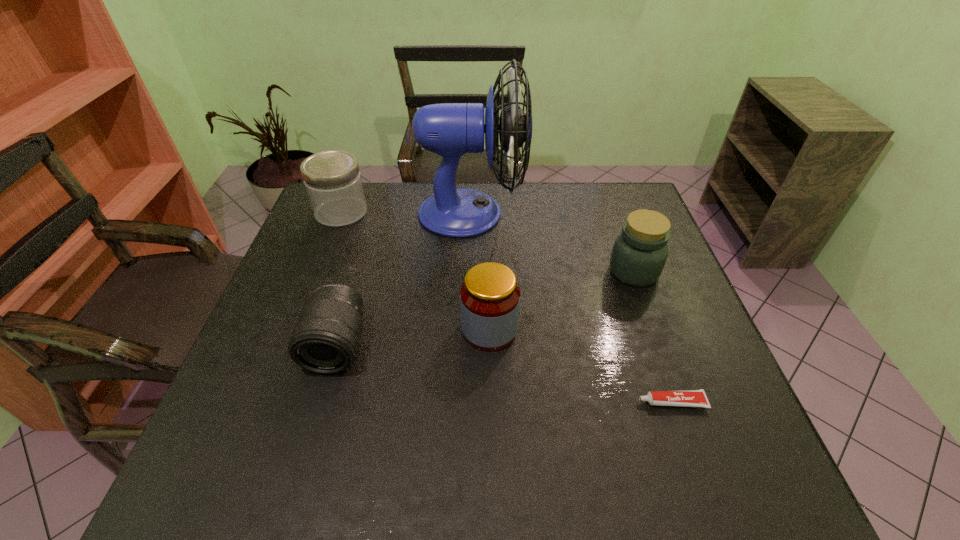
I want to click on free space located 0.140m on the front of the fourth nearest object, so click(656, 332).

Image resolution: width=960 pixels, height=540 pixels. In order to click on free space located 0.220m on the back of the second jar from left to right in this screenshot , I will do `click(488, 252)`.

Image resolution: width=960 pixels, height=540 pixels. In order to click on vacant area situated 0.170m on the surface of the fifth tallest object in this screenshot , I will do (306, 454).

Where is `vacant space located 0.190m at the nozzle of the shortest object`? This screenshot has width=960, height=540. vacant space located 0.190m at the nozzle of the shortest object is located at coordinates (546, 402).

I want to click on vacant space positioned 0.080m at the nozzle of the shortest object, so click(x=600, y=402).

Locate an element on the screen. This screenshot has height=540, width=960. free space located at the nozzle of the shortest object is located at coordinates (556, 402).

The image size is (960, 540). I want to click on fan that is at the far edge, so click(x=450, y=130).

Find the location of `jar at the far edge`. jar at the far edge is located at coordinates 332,178.

The width and height of the screenshot is (960, 540). I want to click on jar that is at the left edge, so point(332,178).

Locate an element on the screen. This screenshot has width=960, height=540. telephoto lens that is at the left edge is located at coordinates (325, 340).